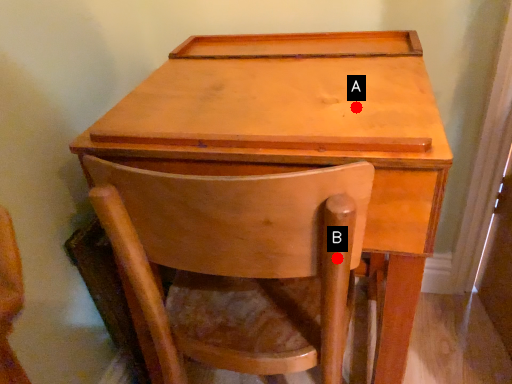
Question: Two points are circled on the image, labeled by A and B beside each circle. Which point is closer to the camera taking this photo?

Choices:
 (A) A is closer
 (B) B is closer

Answer: (B)